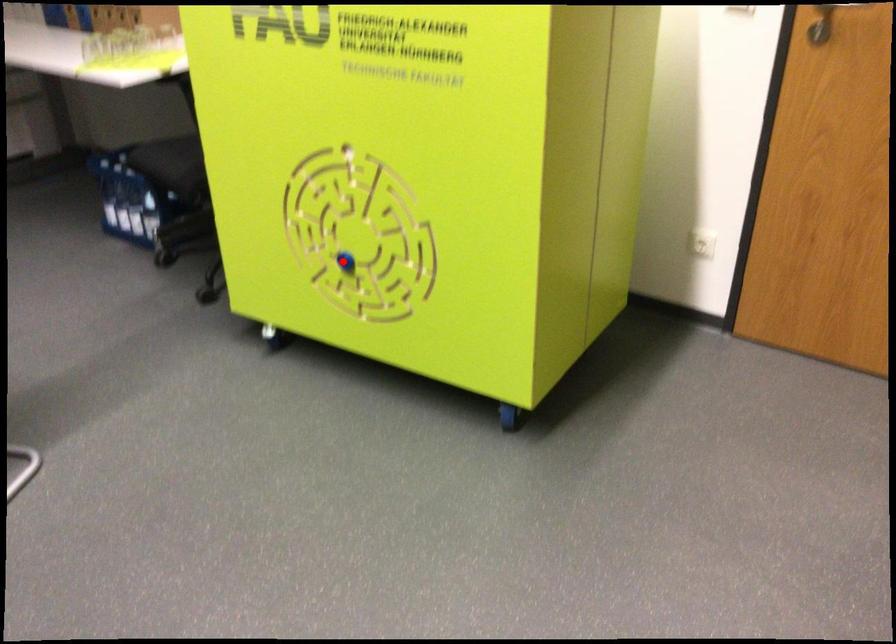
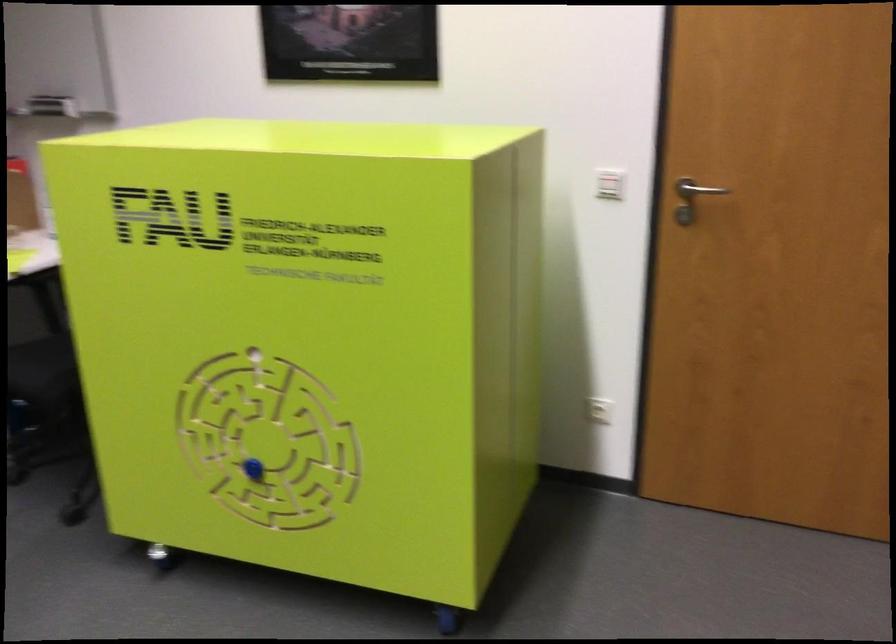
Question: I am providing you with two images of the same scene from different viewpoints. A red point is shown in image1. For the corresponding object point in image2, is it positioned nearer or farther from the camera?

Choices:
 (A) Nearer
 (B) Farther

Answer: (A)